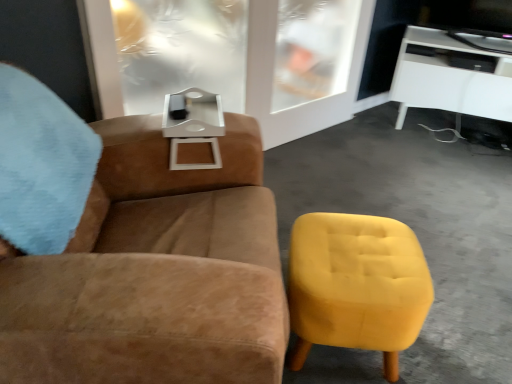
Identify the location of free space in front of white glossy tv stand at upper right. This screenshot has height=384, width=512. (454, 169).